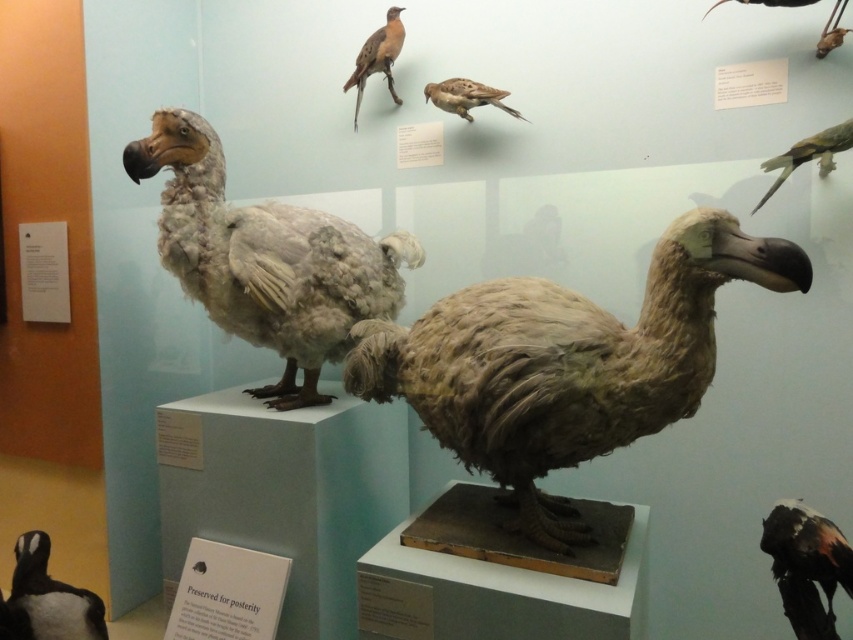
You are standing in the museum and want to take a photo of the brown fuzzy dodo at center. If your camera can focus on objects up to 5 feet away, will it be able to capture the dodo clearly?

The brown fuzzy dodo at center is 4.70 feet away from the viewer. Since the camera can focus up to 5 feet, it will be able to capture the dodo clearly.

You are standing in front of the museum display and want to locate the point at coordinates (x=47, y=600). Which object from the following list is this point located on? The options are the two large dodos, the smaller wall specimens, or the black matte penguin at lower left.

The point at coordinates (x=47, y=600) is located on the black matte penguin at lower left.

You are a visitor at the museum and want to take a photo of the black matte penguin at lower left and the brown speckled feathers at upper center. Which one should you focus on first if you want both in the frame?

The black matte penguin at lower left is positioned on the left side of brown speckled feathers at upper center, so you should focus on the black matte penguin at lower left first to ensure both are in the frame.